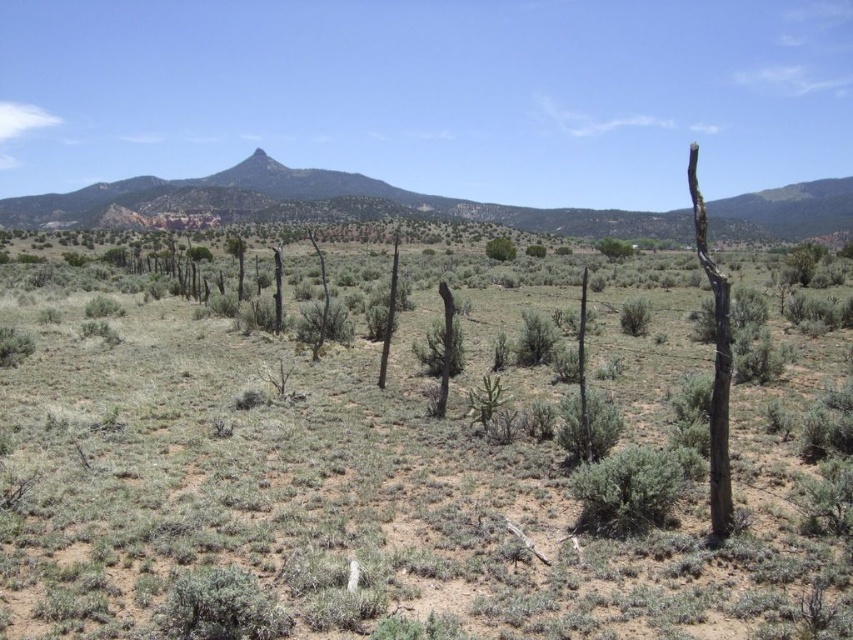
You are standing at the center of the desert scene and see the brown rough tree trunk at right and the green leafy bush at center. Which object is positioned to the right of the other?

The brown rough tree trunk at right is to the right of the green leafy bush at center.